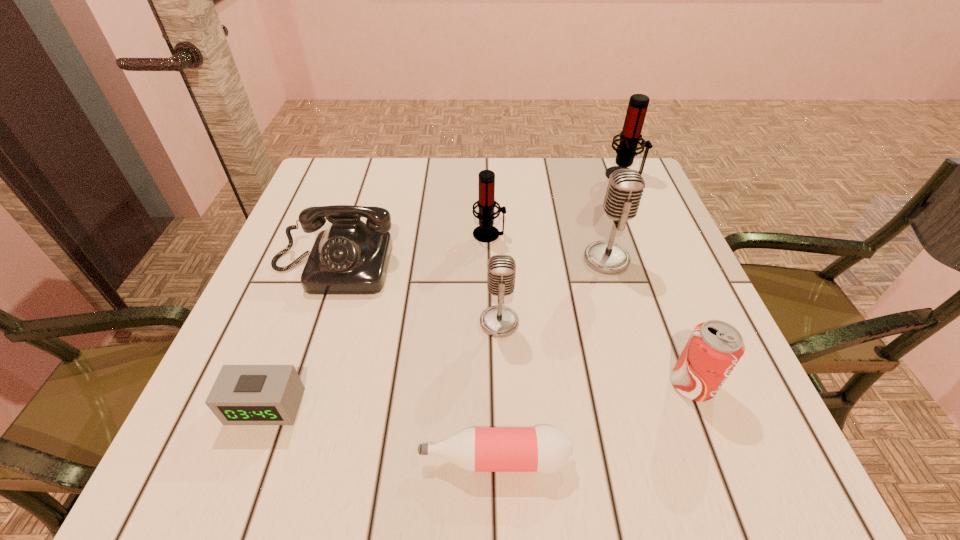
At what (x,y) coordinates should I click in order to perform the action: click on free space in the image that satisfies the following two spatial constraints: 1. on the front side of the soda can; 2. on the right side of the right gray microphone. Please return your answer as a coordinate pair (x, y). This screenshot has height=540, width=960. Looking at the image, I should click on (644, 385).